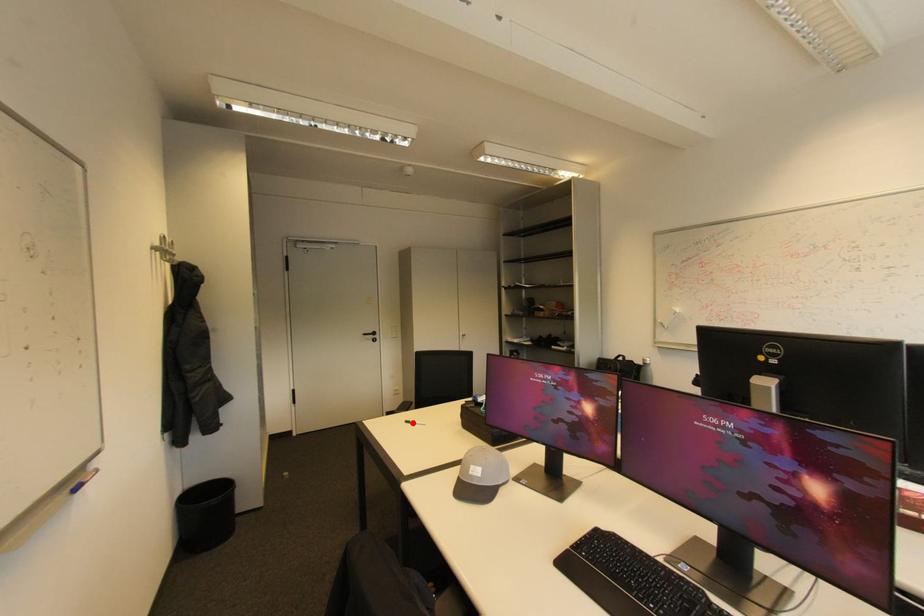
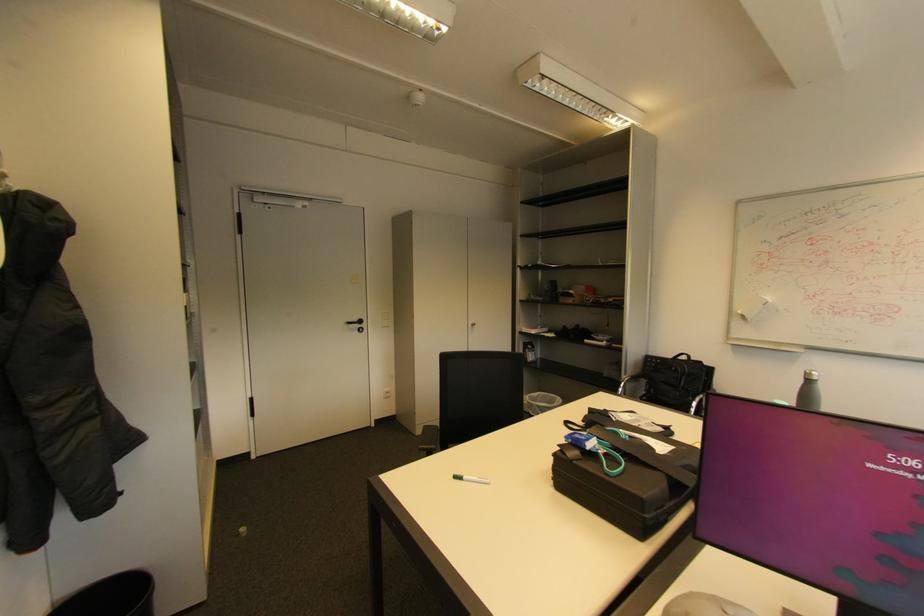
Locate, in the second image, the point that corresponds to the highlighted location in the first image.

(460, 477)